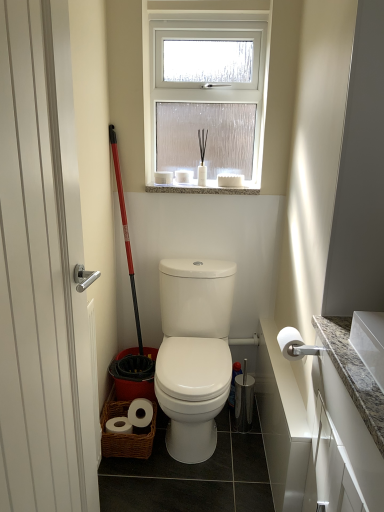
Identify the location of empty space that is ontop of white frosted glass window at upper center. The image size is (384, 512). (206, 12).